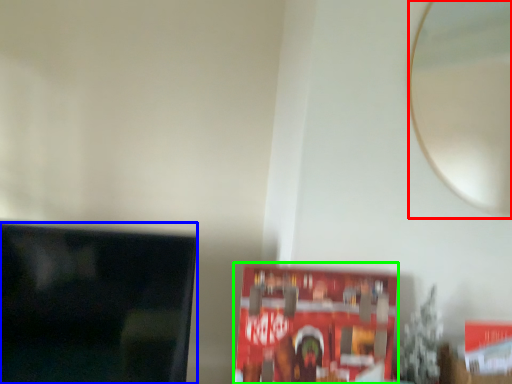
Question: Which object is the farthest from mirror (highlighted by a red box)? Choose among these: television (highlighted by a blue box) or paperback book (highlighted by a green box).

Choices:
 (A) television
 (B) paperback book

Answer: (A)